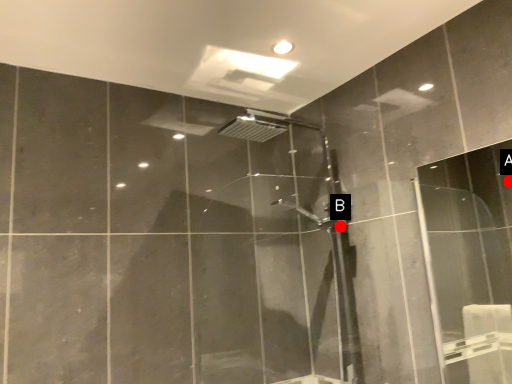
Question: Two points are circled on the image, labeled by A and B beside each circle. Among these points, which one is nearest to the camera?

Choices:
 (A) A is closer
 (B) B is closer

Answer: (B)